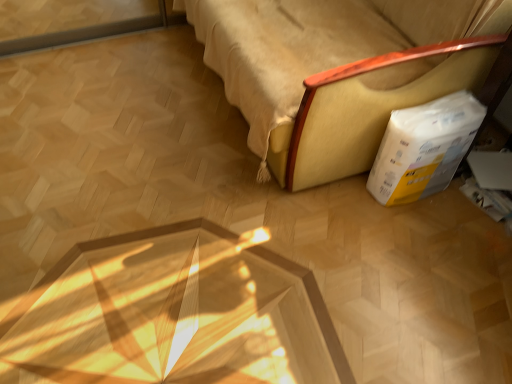
The height and width of the screenshot is (384, 512). What do you see at coordinates (369, 107) in the screenshot? I see `yellow fabric sofa at lower right` at bounding box center [369, 107].

The height and width of the screenshot is (384, 512). What are the coordinates of `yellow fabric sofa at lower right` in the screenshot? It's located at (369, 107).

In order to face yellow fabric sofa at lower right, should I rotate leftwards or rightwards?

Rotate your view right by about 10.209°.

In order to face white/yellow cardboard box at lower right, should I rotate leftwards or rightwards?

To face it directly, rotate right by 21.579 degrees.

You are a GUI agent. You are given a task and a screenshot of the screen. Output one action in this format:
    pyautogui.click(x=<x>, y=<y>)
    Task: Click on the white/yellow cardboard box at lower right
    
    Given the screenshot: What is the action you would take?
    pyautogui.click(x=424, y=148)

This screenshot has height=384, width=512. What do you see at coordinates (424, 148) in the screenshot? I see `white/yellow cardboard box at lower right` at bounding box center [424, 148].

Locate an element on the screen. This screenshot has width=512, height=384. yellow fabric sofa at lower right is located at coordinates (369, 107).

Is white/yellow cardboard box at lower right to the left or to the right of yellow fabric sofa at lower right in the image?

From the image, it's evident that white/yellow cardboard box at lower right is to the right of yellow fabric sofa at lower right.

Which object is closer to the camera taking this photo, white/yellow cardboard box at lower right or yellow fabric sofa at lower right?

yellow fabric sofa at lower right.

Which point is more distant from viewer, (397, 114) or (272, 136)?

The point (272, 136) is farther.

From the image's perspective, is white/yellow cardboard box at lower right located beneath yellow fabric sofa at lower right?

Correct, white/yellow cardboard box at lower right appears lower than yellow fabric sofa at lower right in the image.

From a real-world perspective, does white/yellow cardboard box at lower right stand above yellow fabric sofa at lower right?

Actually, white/yellow cardboard box at lower right is physically below yellow fabric sofa at lower right in the real world.

Does white/yellow cardboard box at lower right have a greater width compared to yellow fabric sofa at lower right?

No.

Between white/yellow cardboard box at lower right and yellow fabric sofa at lower right, which one has less height?

white/yellow cardboard box at lower right is shorter.

Which of these two, white/yellow cardboard box at lower right or yellow fabric sofa at lower right, is smaller?

Smaller between the two is white/yellow cardboard box at lower right.

Which is correct: white/yellow cardboard box at lower right is inside yellow fabric sofa at lower right, or outside of it?

white/yellow cardboard box at lower right cannot be found inside yellow fabric sofa at lower right.

Is white/yellow cardboard box at lower right beside yellow fabric sofa at lower right?

There is a gap between white/yellow cardboard box at lower right and yellow fabric sofa at lower right.

Is white/yellow cardboard box at lower right facing towards yellow fabric sofa at lower right?

No, white/yellow cardboard box at lower right is not turned towards yellow fabric sofa at lower right.

How far apart are white/yellow cardboard box at lower right and yellow fabric sofa at lower right?

They are 8.13 inches apart.

Find the location of a particular element. This screenshot has width=512, height=384. furniture in front of the white/yellow cardboard box at lower right is located at coordinates (369, 107).

Does yellow fabric sofa at lower right appear on the right side of white/yellow cardboard box at lower right?

Incorrect, yellow fabric sofa at lower right is not on the right side of white/yellow cardboard box at lower right.

Considering their positions, is yellow fabric sofa at lower right located in front of or behind white/yellow cardboard box at lower right?

yellow fabric sofa at lower right is positioned closer to the viewer than white/yellow cardboard box at lower right.

Is point (310, 87) less distant than point (445, 158)?

Yes, it is in front of point (445, 158).

Based on the photo, from the image's perspective, would you say yellow fabric sofa at lower right is shown under white/yellow cardboard box at lower right?

No.

From a real-world perspective, is yellow fabric sofa at lower right positioned above or below white/yellow cardboard box at lower right?

yellow fabric sofa at lower right is above white/yellow cardboard box at lower right.

Which of these two, yellow fabric sofa at lower right or white/yellow cardboard box at lower right, is thinner?

With smaller width is white/yellow cardboard box at lower right.

Considering the sizes of objects yellow fabric sofa at lower right and white/yellow cardboard box at lower right in the image provided, who is taller, yellow fabric sofa at lower right or white/yellow cardboard box at lower right?

yellow fabric sofa at lower right is taller.

Who is bigger, yellow fabric sofa at lower right or white/yellow cardboard box at lower right?

With larger size is yellow fabric sofa at lower right.

Could white/yellow cardboard box at lower right be considered to be inside yellow fabric sofa at lower right?

No, yellow fabric sofa at lower right does not contain white/yellow cardboard box at lower right.

Is yellow fabric sofa at lower right far from white/yellow cardboard box at lower right?

They are positioned close to each other.

Is yellow fabric sofa at lower right oriented towards white/yellow cardboard box at lower right?

No, yellow fabric sofa at lower right is not oriented towards white/yellow cardboard box at lower right.

How many degrees apart are the facing directions of yellow fabric sofa at lower right and white/yellow cardboard box at lower right?

yellow fabric sofa at lower right and white/yellow cardboard box at lower right are facing 2.04 degrees away from each other.

Identify the location of cardboard box below the yellow fabric sofa at lower right (from the image's perspective). This screenshot has height=384, width=512. (424, 148).

The image size is (512, 384). Identify the location of cardboard box located underneath the yellow fabric sofa at lower right (from a real-world perspective). (424, 148).

Where is `cardboard box on the right of yellow fabric sofa at lower right`? cardboard box on the right of yellow fabric sofa at lower right is located at coordinates (424, 148).